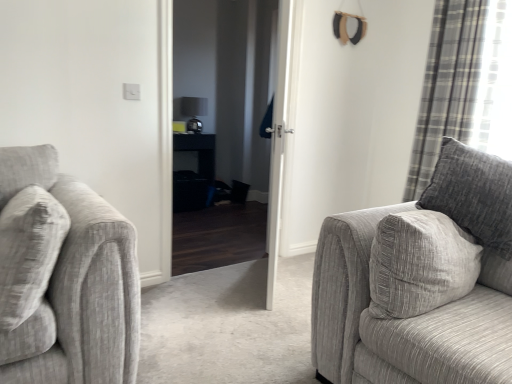
Question: Is plaid fabric curtain at right touching white glossy door at center?

Choices:
 (A) no
 (B) yes

Answer: (A)

Question: Does plaid fabric curtain at right appear on the right side of white glossy door at center?

Choices:
 (A) yes
 (B) no

Answer: (A)

Question: Is plaid fabric curtain at right smaller than white glossy door at center?

Choices:
 (A) no
 (B) yes

Answer: (A)

Question: From the image's perspective, is plaid fabric curtain at right below white glossy door at center?

Choices:
 (A) no
 (B) yes

Answer: (A)

Question: Is plaid fabric curtain at right not within white glossy door at center?

Choices:
 (A) no
 (B) yes

Answer: (B)

Question: Does point (485, 241) appear closer or farther from the camera than point (279, 89)?

Choices:
 (A) farther
 (B) closer

Answer: (B)

Question: From their relative heights in the image, would you say textured gray couch at right is taller or shorter than white glossy door at center?

Choices:
 (A) short
 (B) tall

Answer: (A)

Question: Is textured gray couch at right wider or thinner than white glossy door at center?

Choices:
 (A) wide
 (B) thin

Answer: (A)

Question: From the image's perspective, is textured gray couch at right located above or below white glossy door at center?

Choices:
 (A) below
 (B) above

Answer: (A)

Question: In terms of height, does textured gray couch at right look taller or shorter compared to black glossy door at center?

Choices:
 (A) tall
 (B) short

Answer: (B)

Question: Visually, is textured gray couch at right positioned to the left or to the right of black glossy door at center?

Choices:
 (A) left
 (B) right

Answer: (B)

Question: In terms of size, does textured gray couch at right appear bigger or smaller than black glossy door at center?

Choices:
 (A) small
 (B) big

Answer: (B)

Question: Is textured gray couch at right in front of or behind black glossy door at center in the image?

Choices:
 (A) behind
 (B) front

Answer: (B)

Question: Based on their positions, is plaid fabric curtain at right located to the left or right of textured gray couch at right?

Choices:
 (A) right
 (B) left

Answer: (A)

Question: From a real-world perspective, is plaid fabric curtain at right physically located above or below textured gray couch at right?

Choices:
 (A) below
 (B) above

Answer: (B)